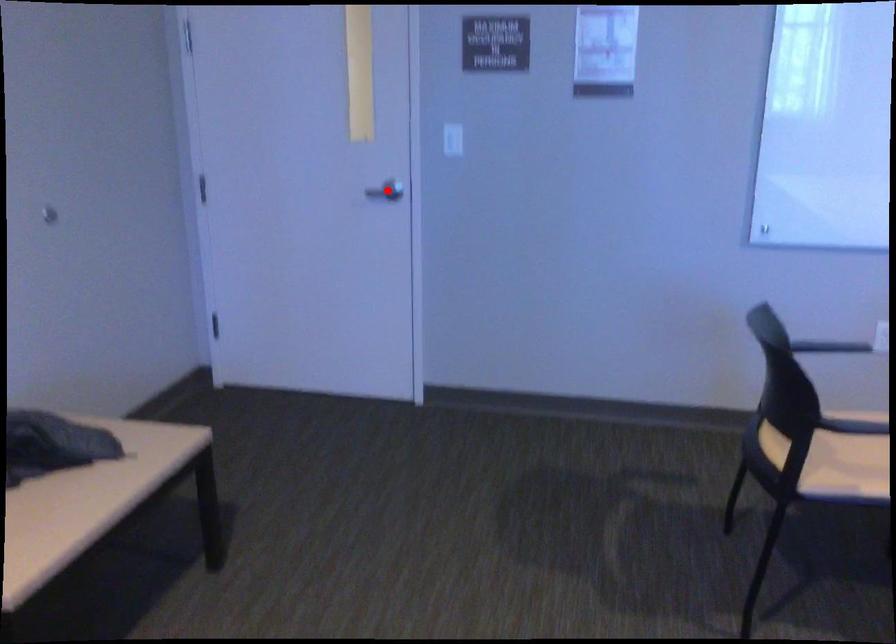
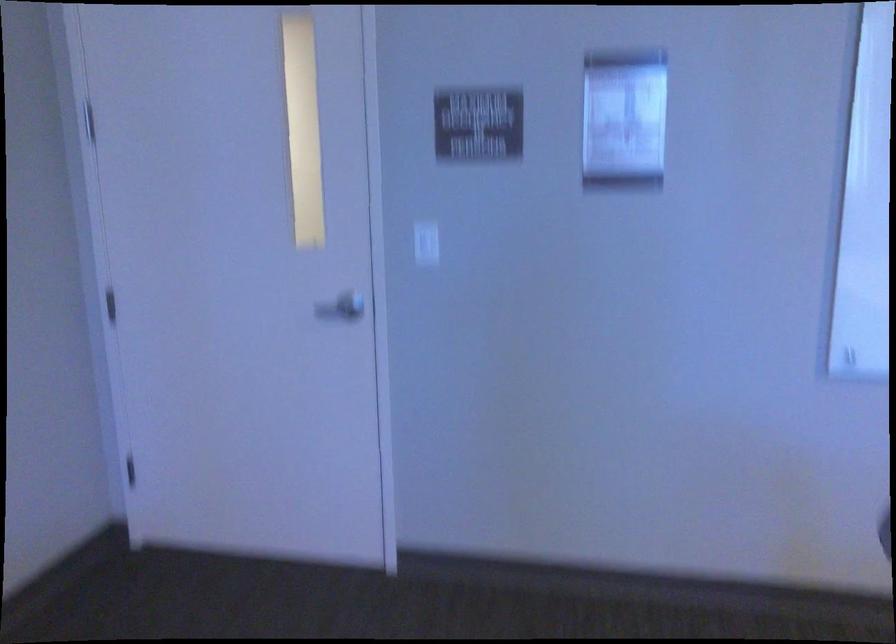
Question: A red point is marked in image1. In image2, is the corresponding 3D point closer to the camera or farther? Reply with the corresponding letter.

Choices:
 (A) The corresponding 3D point is closer.
 (B) The corresponding 3D point is farther.

Answer: (A)